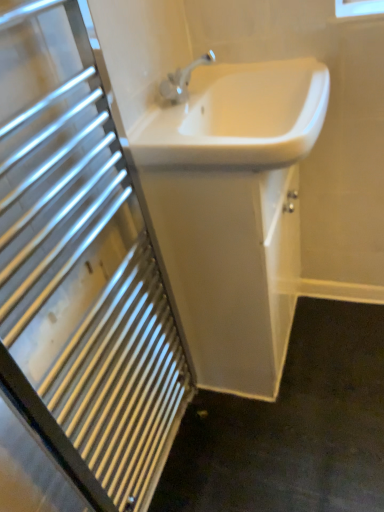
Question: Is white glossy sink at center, which appears as the 2th sink when viewed from the top, situated inside white glossy sink at upper center or outside?

Choices:
 (A) inside
 (B) outside

Answer: (B)

Question: Would you say white glossy sink at center, which appears as the 1th sink when ordered from the bottom, is to the left or to the right of white glossy sink at upper center in the picture?

Choices:
 (A) right
 (B) left

Answer: (A)

Question: Which object is positioned farthest from the white glossy sink at upper center?

Choices:
 (A) white glossy sink at center, which appears as the 1th sink when ordered from the bottom
 (B) white glossy sink at center, which is the 2th sink from bottom to top

Answer: (B)

Question: Estimate the real-world distances between objects in this image. Which object is farther from the white glossy sink at center, arranged as the first sink when viewed from the top?

Choices:
 (A) white glossy sink at upper center
 (B) white glossy sink at center, which appears as the 1th sink when ordered from the bottom

Answer: (A)